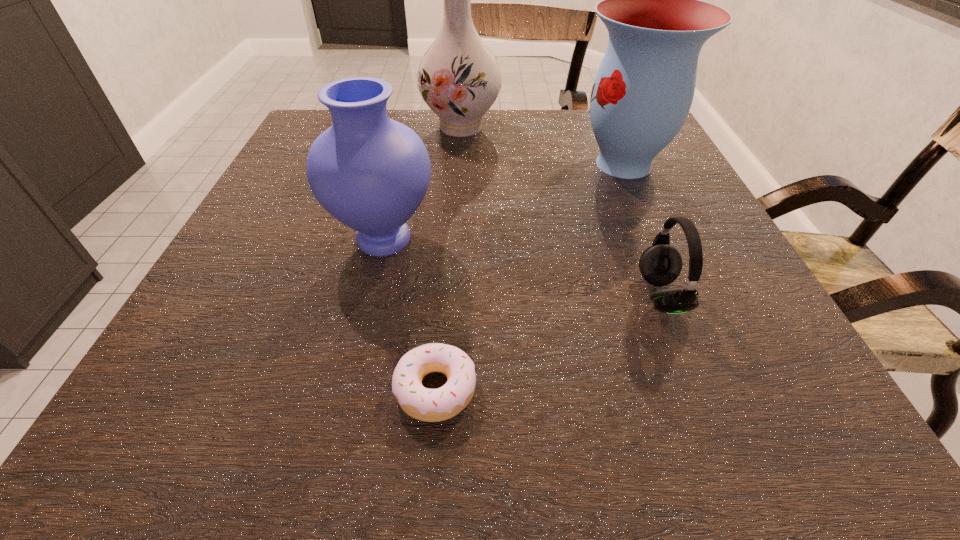
Find the location of `vacant point located on the back of the shortest object`. vacant point located on the back of the shortest object is located at coordinates (446, 249).

You are a GUI agent. You are given a task and a screenshot of the screen. Output one action in this format:
    pyautogui.click(x=<x>, y=<y>)
    Task: Click on the object present at the near edge
    
    Given the screenshot: What is the action you would take?
    pyautogui.click(x=430, y=405)

Where is `vase present at the right edge`? The height and width of the screenshot is (540, 960). vase present at the right edge is located at coordinates pos(642,93).

You are a GUI agent. You are given a task and a screenshot of the screen. Output one action in this format:
    pyautogui.click(x=<x>, y=<y>)
    Task: Click on the headset that is at the right edge
    The image size is (960, 540).
    Given the screenshot: What is the action you would take?
    pyautogui.click(x=660, y=264)

At what (x,y) coordinates should I click in order to perform the action: click on object that is positioned at the far right corner. Please return your answer as a coordinate pair (x, y). Looking at the image, I should click on (642, 93).

I want to click on vacant space at the far edge of the desktop, so click(561, 133).

In the image, there is a desktop. Where is `free space at the left edge`? Image resolution: width=960 pixels, height=540 pixels. free space at the left edge is located at coordinates (237, 319).

You are a GUI agent. You are given a task and a screenshot of the screen. Output one action in this format:
    pyautogui.click(x=<x>, y=<y>)
    Task: Click on the free point at the right edge
    This screenshot has width=960, height=540.
    Given the screenshot: What is the action you would take?
    pyautogui.click(x=636, y=191)

In the image, there is a desktop. Identify the location of vacant space at the far left corner. Image resolution: width=960 pixels, height=540 pixels. pyautogui.click(x=307, y=136).

In the image, there is a desktop. Identify the location of vacant space at the near right corner. The width and height of the screenshot is (960, 540). [x=804, y=397].